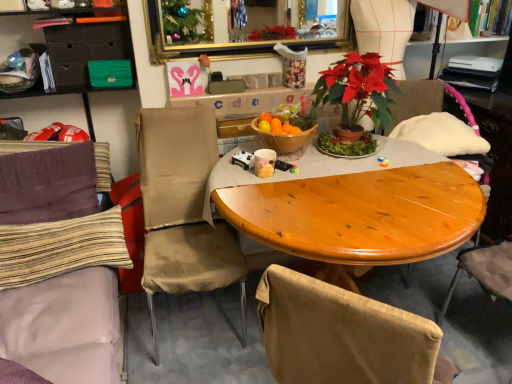
Question: Considering the relative positions of wooden armchair at right and matte black drawer at upper left in the image provided, is wooden armchair at right to the left of matte black drawer at upper left from the viewer's perspective?

Choices:
 (A) no
 (B) yes

Answer: (A)

Question: Can you confirm if wooden armchair at right is wider than matte black drawer at upper left?

Choices:
 (A) no
 (B) yes

Answer: (B)

Question: From a real-world perspective, is wooden armchair at right positioned over matte black drawer at upper left based on gravity?

Choices:
 (A) yes
 (B) no

Answer: (B)

Question: From a real-world perspective, is wooden armchair at right positioned under matte black drawer at upper left based on gravity?

Choices:
 (A) yes
 (B) no

Answer: (A)

Question: Is wooden armchair at right bigger than matte black drawer at upper left?

Choices:
 (A) yes
 (B) no

Answer: (A)

Question: Are wooden armchair at right and matte black drawer at upper left far apart?

Choices:
 (A) no
 (B) yes

Answer: (B)

Question: Is purple knitted pillow at left, which ranks as the 2th pillow in bottom-to-top order, at the right side of beige fabric chair at center, which is the 2th chair from left to right?

Choices:
 (A) no
 (B) yes

Answer: (A)

Question: From the image's perspective, is purple knitted pillow at left, the first pillow when ordered from top to bottom, beneath beige fabric chair at center, the first chair positioned from the right?

Choices:
 (A) no
 (B) yes

Answer: (A)

Question: Is the position of purple knitted pillow at left, the first pillow when ordered from top to bottom, less distant than that of beige fabric chair at center, which is the 2th chair from left to right?

Choices:
 (A) no
 (B) yes

Answer: (A)

Question: Can you confirm if purple knitted pillow at left, the first pillow when ordered from top to bottom, is smaller than beige fabric chair at center, which is the 2th chair from left to right?

Choices:
 (A) yes
 (B) no

Answer: (A)

Question: Is purple knitted pillow at left, which ranks as the 2th pillow in bottom-to-top order, bigger than beige fabric chair at center, the first chair positioned from the right?

Choices:
 (A) no
 (B) yes

Answer: (A)

Question: Does purple knitted pillow at left, which ranks as the 2th pillow in bottom-to-top order, have a greater width compared to beige fabric chair at center, the first chair positioned from the right?

Choices:
 (A) no
 (B) yes

Answer: (A)

Question: Is wooden armchair at right at the right side of gold-framed mirror at upper center?

Choices:
 (A) no
 (B) yes

Answer: (B)